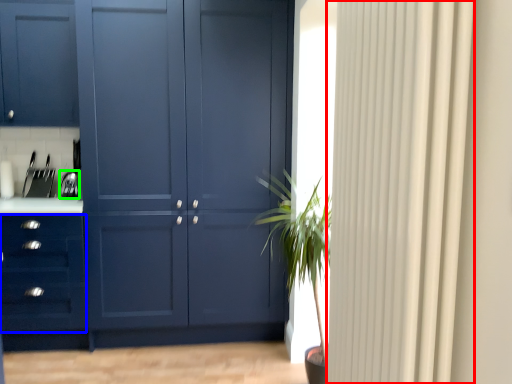
Question: Which is farther away from curtain (highlighted by a red box)? drawer (highlighted by a blue box) or appliance (highlighted by a green box)?

Choices:
 (A) drawer
 (B) appliance

Answer: (B)